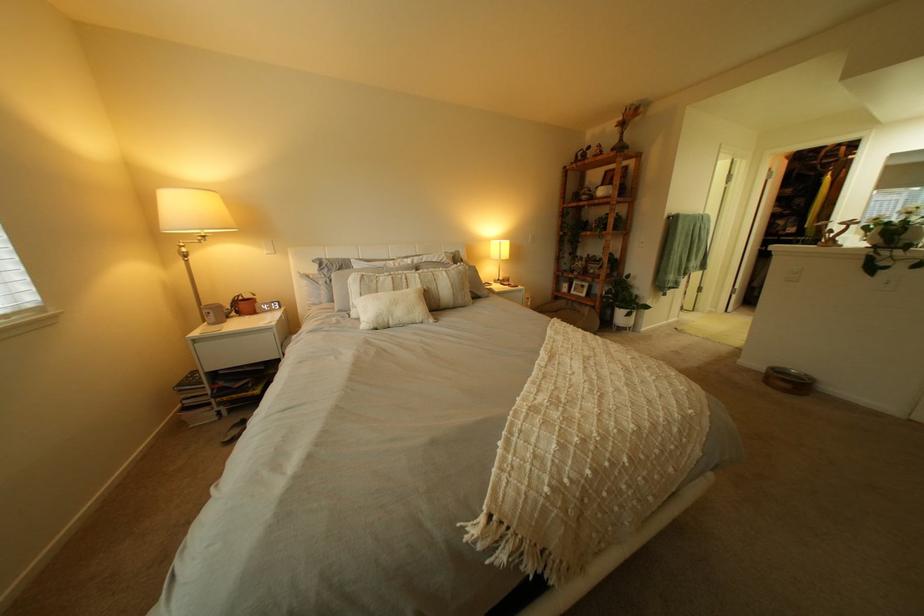
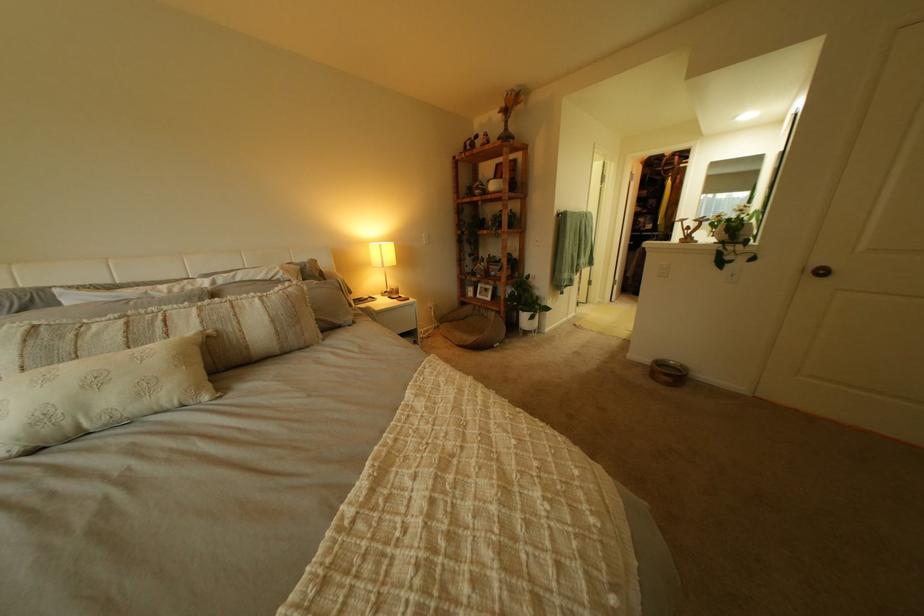
Locate, in the second image, the point that corresponds to the point at 579,294 in the first image.

(485, 300)